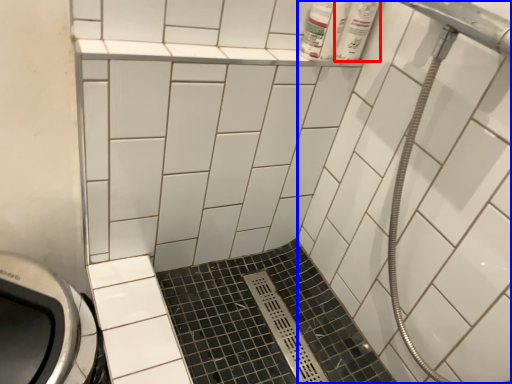
Question: Which point is further to the camera, toiletry (highlighted by a red box) or bath (highlighted by a blue box)?

Choices:
 (A) toiletry
 (B) bath

Answer: (A)